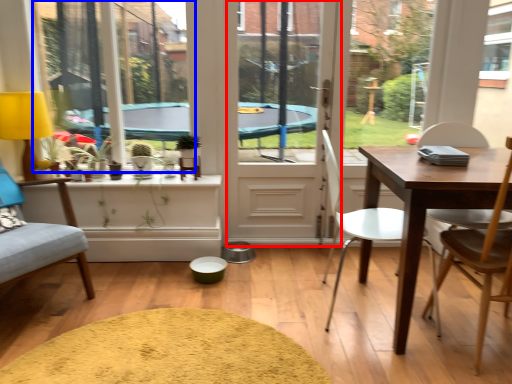
Question: Which of the following is the farthest to the observer, screen door (highlighted by a red box) or window screen (highlighted by a blue box)?

Choices:
 (A) screen door
 (B) window screen

Answer: (A)